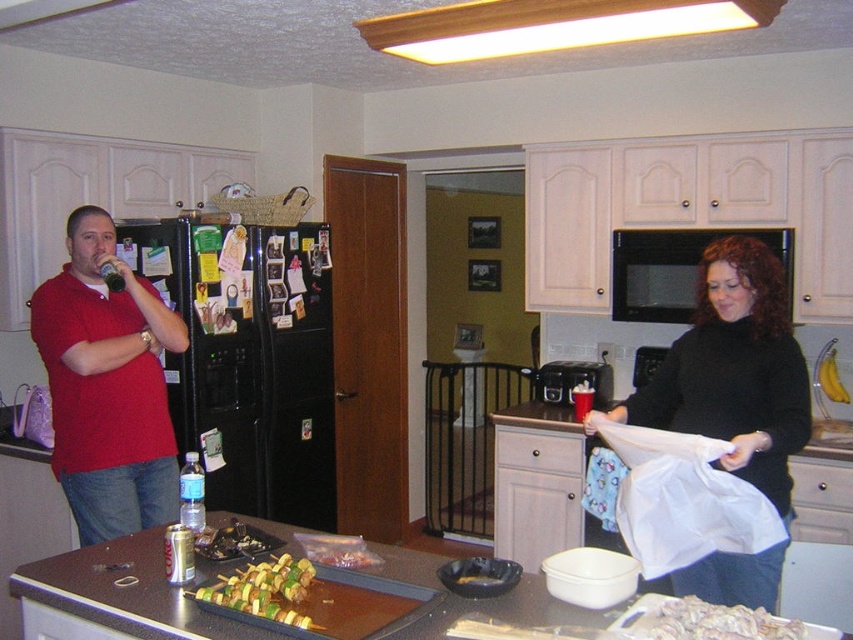
Is wooden frame fluorescent light at upper center shorter than white crumbly food at lower right?

No.

Measure the distance between wooden frame fluorescent light at upper center and camera.

wooden frame fluorescent light at upper center and camera are 5.20 feet apart from each other.

The height and width of the screenshot is (640, 853). I want to click on wooden frame fluorescent light at upper center, so click(552, 26).

Does matte red shirt at left have a larger size compared to white crumbly food at lower right?

Yes.

Find the location of `matte red shirt at left`. matte red shirt at left is located at coordinates (107, 385).

Between black matte shirt at center and wooden frame fluorescent light at upper center, which one appears on the left side from the viewer's perspective?

Positioned to the left is wooden frame fluorescent light at upper center.

Find the location of a particular element. black matte shirt at center is located at coordinates (734, 371).

Locate an element on the screen. Image resolution: width=853 pixels, height=640 pixels. black matte shirt at center is located at coordinates (734, 371).